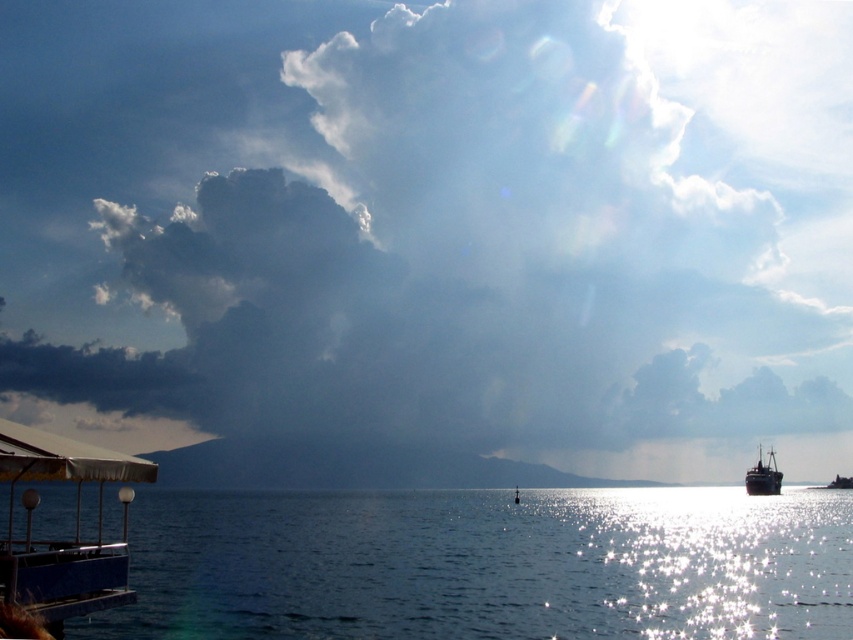
You are standing on the beach and looking at the dark gray cloud at upper center and the blue water at lower left. Which object is closer to you?

The dark gray cloud at upper center is closer to you because it is further to the viewer than the blue water at lower left.

You are a photographer planning to capture the blue water at lower left and the shiny dark wood ship at right in a single shot. Which object will occupy more of the frame?

The blue water at lower left is larger in size than the shiny dark wood ship at right, so it will occupy more of the frame.